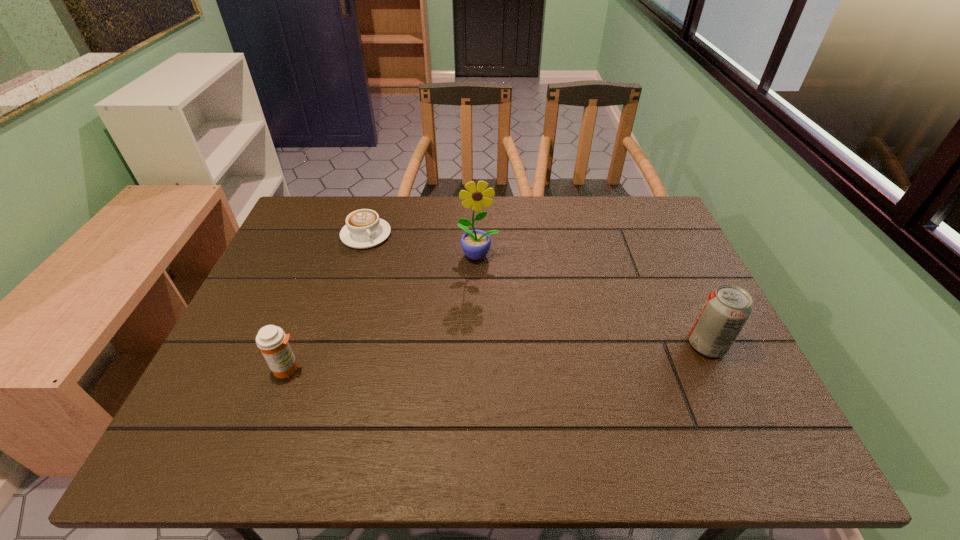
Identify the location of vacant space that's between the soda can and the sunflower. (592, 300).

Where is `unoccupied area between the medicine and the second object from right to left`? The height and width of the screenshot is (540, 960). unoccupied area between the medicine and the second object from right to left is located at coordinates (383, 312).

Find the location of a particular element. free space between the sunflower and the second shortest object is located at coordinates (383, 312).

The image size is (960, 540). Identify the location of vacant space that is in between the rightmost object and the second object from right to left. (592, 300).

Identify the location of free point between the cappuccino and the tallest object. This screenshot has height=540, width=960. (422, 245).

Select which object is the second closest to the tallest object. Please provide its 2D coordinates. Your answer should be formatted as a tuple, i.e. [(x, y)], where the tuple contains the x and y coordinates of a point satisfying the conditions above.

[(272, 341)]

The width and height of the screenshot is (960, 540). I want to click on the second closest object to the soda can, so click(364, 229).

You are a GUI agent. You are given a task and a screenshot of the screen. Output one action in this format:
    pyautogui.click(x=<x>, y=<y>)
    Task: Click on the blank area in the image that satisfies the following two spatial constraints: 1. on the front side of the sunflower; 2. on the right side of the third shortest object
    The height and width of the screenshot is (540, 960).
    Given the screenshot: What is the action you would take?
    pyautogui.click(x=478, y=345)

In order to click on free point that satisfies the following two spatial constraints: 1. on the front side of the shortest object; 2. on the right side of the tallest object in this screenshot , I will do `click(360, 255)`.

I want to click on free space in the image that satisfies the following two spatial constraints: 1. on the front side of the soda can; 2. on the left side of the tallest object, so click(x=478, y=345).